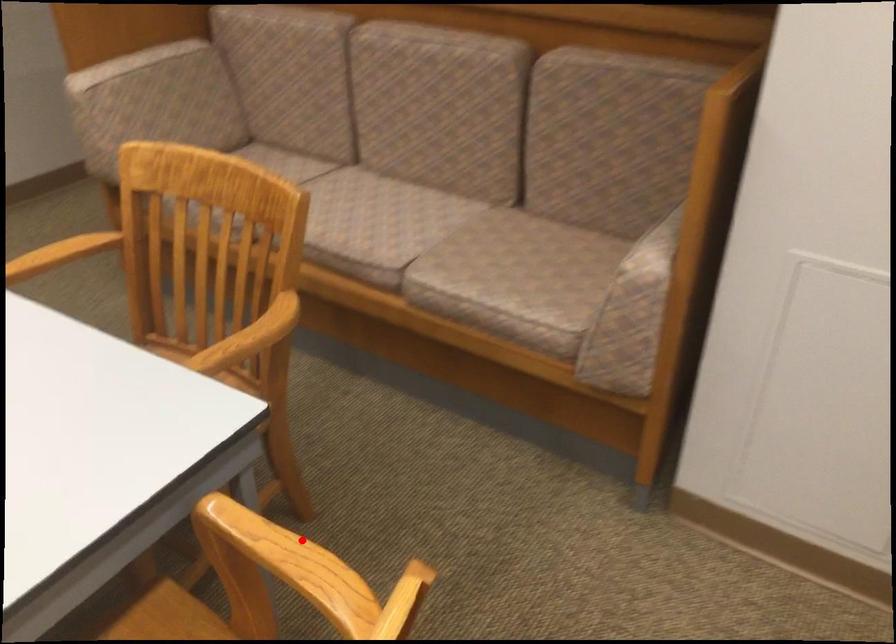
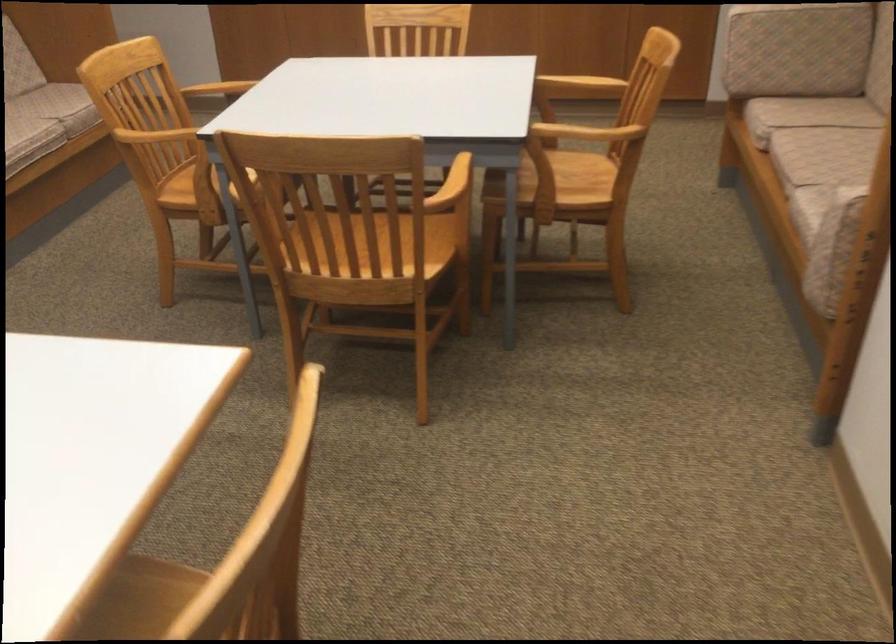
Where in the second image is the point corresponding to the highlighted location from the first image?

(470, 174)